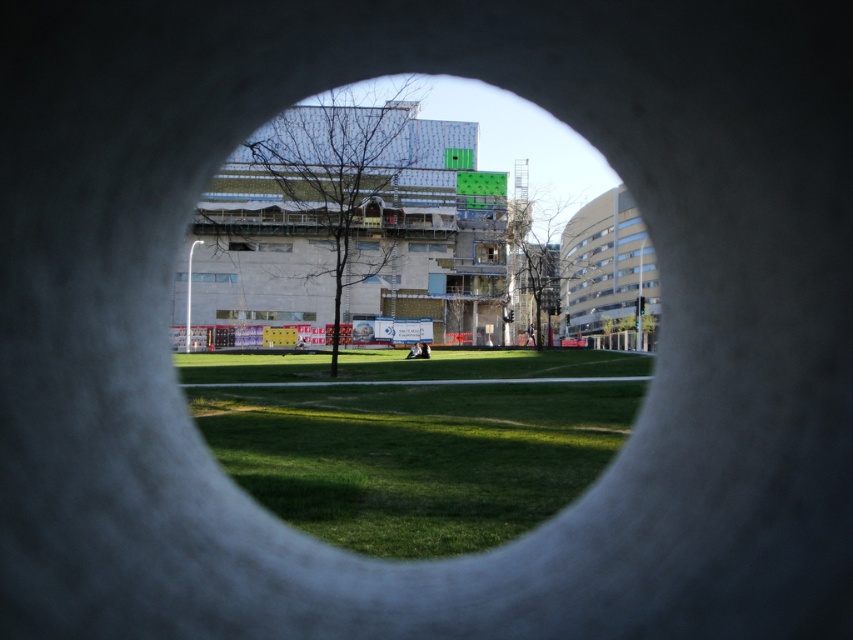
You are standing in a room with a circular opening in the wall. You want to know where the white concrete hole at center is located. Can you determine its position based on the coordinates provided?

The white concrete hole at center is located at coordinates point (403, 339).

You are a landscape architect designing a garden. You want to place a new statue exactly where the white concrete hole at center and green grass at center meet. Based on the scene description, which object should the statue be placed closer to, considering their heights?

The white concrete hole at center has a greater height compared to green grass at center, so the statue should be placed closer to the white concrete hole at center.